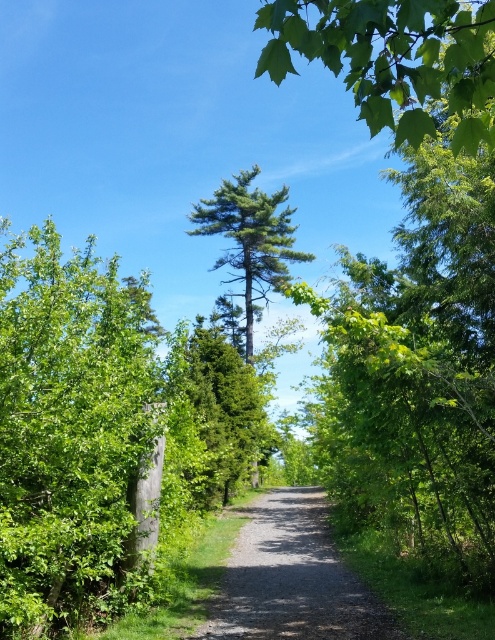
Question: Which object appears farthest from the camera in this image?

Choices:
 (A) green leafy tree at left
 (B) green needle-like tree at center

Answer: (B)

Question: Can you confirm if green leafy tree at left is positioned above green leafy tree at upper center?

Choices:
 (A) yes
 (B) no

Answer: (B)

Question: Does green leafy tree at left appear under dirt/gravel path at center?

Choices:
 (A) yes
 (B) no

Answer: (B)

Question: Which object is the farthest from the green needle-like tree at center?

Choices:
 (A) green leafy tree at upper center
 (B) green leafy tree at left
 (C) dirt/gravel path at center

Answer: (A)

Question: Which point appears farthest from the camera in this image?

Choices:
 (A) (298, 20)
 (B) (267, 609)
 (C) (128, 337)
 (D) (251, 294)

Answer: (D)

Question: Does green leafy tree at left appear under dirt/gravel path at center?

Choices:
 (A) yes
 (B) no

Answer: (B)